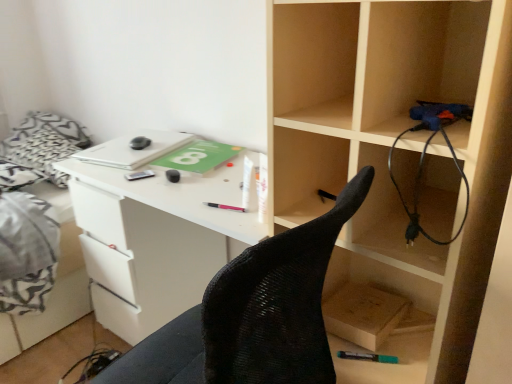
Find the location of a particular element. The height and width of the screenshot is (384, 512). vacant area that is situated to the right of black rubber mouse at center, which ranks as the second stationery in back-to-front order is located at coordinates (214, 177).